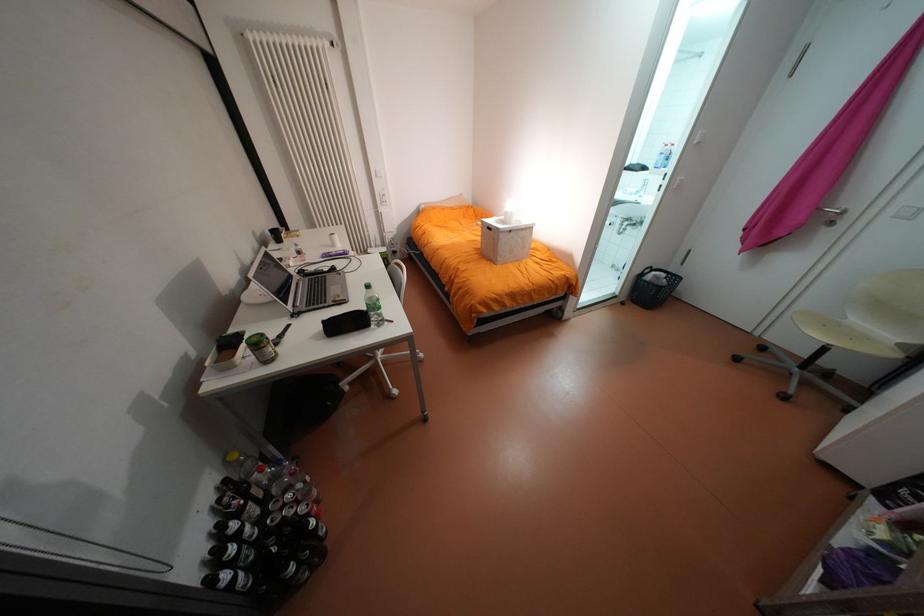
Which object does [372,306] point to?

It corresponds to the clear plastic bottle in the image.